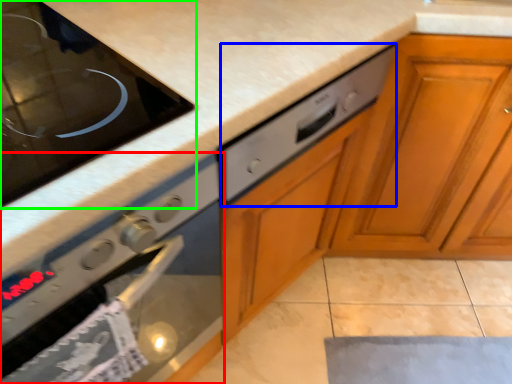
Question: Based on their relative distances, which object is nearer to oven (highlighted by a red box)? Choose from drawer (highlighted by a blue box) and home appliance (highlighted by a green box).

Choices:
 (A) drawer
 (B) home appliance

Answer: (A)